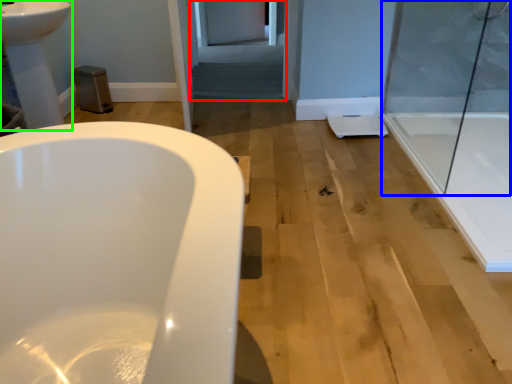
Question: Based on their relative distances, which object is farther from screen door (highlighted by a red box)? Choose from shower door (highlighted by a blue box) and sink (highlighted by a green box).

Choices:
 (A) shower door
 (B) sink

Answer: (B)